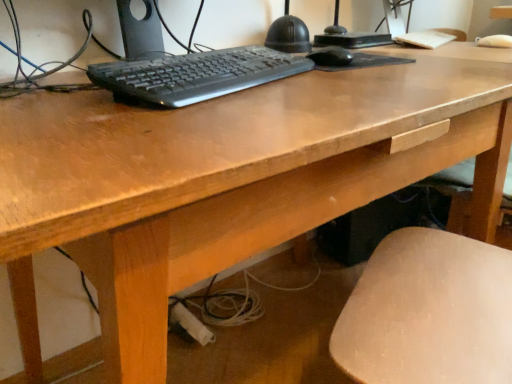
Locate an element on the screen. empty space that is to the right of black matte mouse at center is located at coordinates (368, 58).